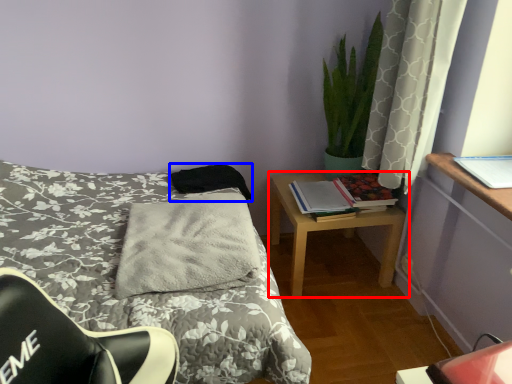
Question: Which of the following is the farthest to the observer, nightstand (highlighted by a red box) or pillow (highlighted by a blue box)?

Choices:
 (A) nightstand
 (B) pillow

Answer: (B)